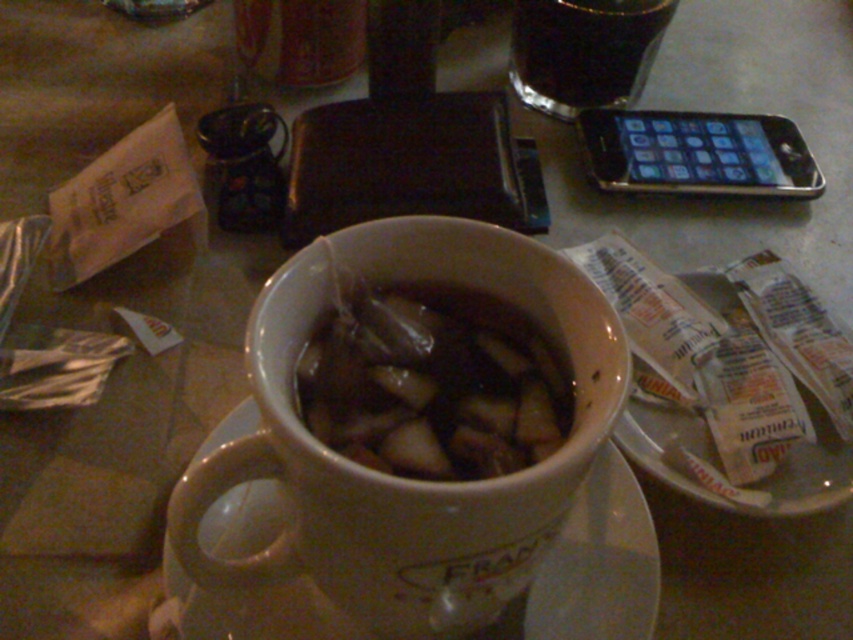
Question: Can you confirm if translucent plastic bag at center is positioned above dark brown liquid at upper center?

Choices:
 (A) yes
 (B) no

Answer: (B)

Question: Estimate the real-world distances between objects in this image. Which object is farther from the dark brown liquid at upper center?

Choices:
 (A) black metallic smartphone at upper right
 (B) white ceramic saucer at center
 (C) translucent plastic bag at center

Answer: (B)

Question: Which point is closer to the camera taking this photo?

Choices:
 (A) (544, 70)
 (B) (616, 627)

Answer: (B)

Question: Can you confirm if white ceramic saucer at center is positioned to the right of black metallic smartphone at upper right?

Choices:
 (A) yes
 (B) no

Answer: (B)

Question: Does translucent plastic bag at center have a larger size compared to white ceramic saucer at center?

Choices:
 (A) yes
 (B) no

Answer: (B)

Question: Which object is positioned farthest from the black metallic smartphone at upper right?

Choices:
 (A) dark brown liquid at upper center
 (B) white ceramic saucer at center

Answer: (B)